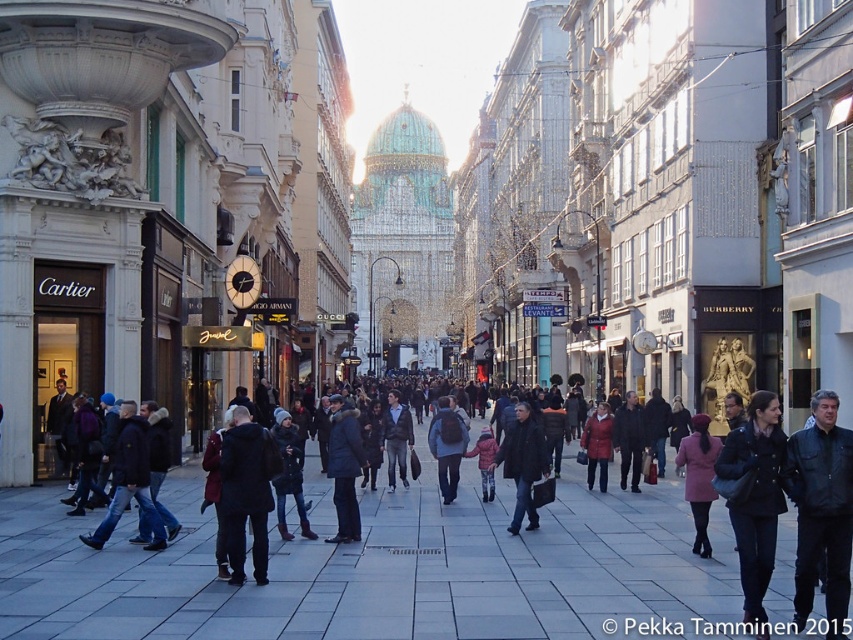
Question: Which object appears closest to the camera in this image?

Choices:
 (A) dark gray jacket at center
 (B) dark gray wool coat at center
 (C) dark blue fur-trimmed coat at center
 (D) matte red coat at center

Answer: (B)

Question: Which object is closer to the camera taking this photo?

Choices:
 (A) dark blue coat at center
 (B) matte red coat at center
 (C) gray stone pavement at center
 (D) dark blue textured coat at center

Answer: (C)

Question: Where is dark blue fur-trimmed coat at center located in relation to matte red coat at center in the image?

Choices:
 (A) below
 (B) above

Answer: (B)

Question: Which point appears farthest from the camera in this image?

Choices:
 (A) (743, 612)
 (B) (585, 451)
 (C) (521, 401)

Answer: (C)

Question: Is gray stone pavement at center bigger than dark gray wool coat at center?

Choices:
 (A) no
 (B) yes

Answer: (B)

Question: Is dark blue jacket at lower left positioned behind matte red coat at center?

Choices:
 (A) yes
 (B) no

Answer: (B)